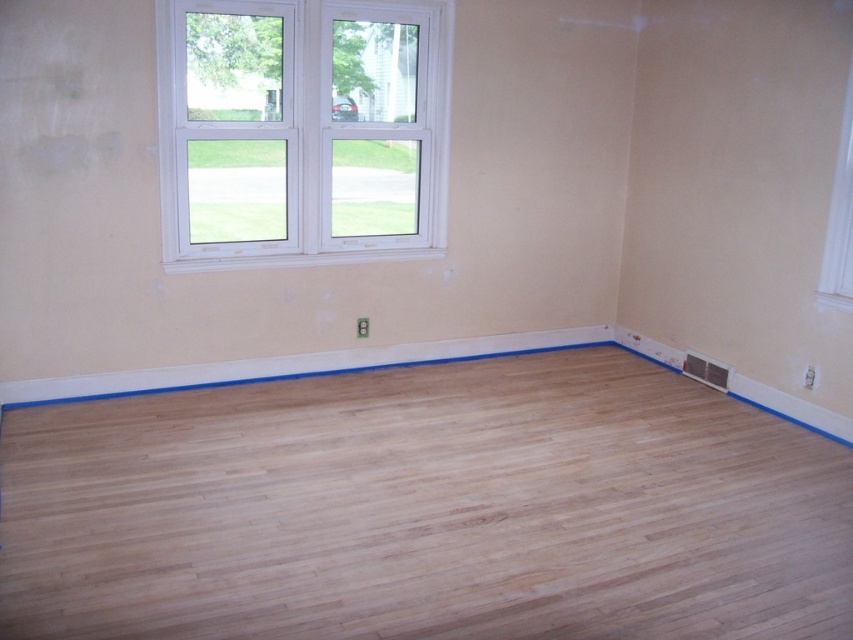
Question: Which of the following is the farthest from the observer?

Choices:
 (A) (80, 408)
 (B) (160, 8)

Answer: (A)

Question: Does natural wood floor at center have a lesser width compared to white plastic window at upper left?

Choices:
 (A) no
 (B) yes

Answer: (A)

Question: Considering the relative positions of natural wood floor at center and white plastic window at upper left in the image provided, where is natural wood floor at center located with respect to white plastic window at upper left?

Choices:
 (A) right
 (B) left

Answer: (A)

Question: Can you confirm if natural wood floor at center is thinner than white plastic window at upper left?

Choices:
 (A) no
 (B) yes

Answer: (A)

Question: Which point is farther to the camera?

Choices:
 (A) natural wood floor at center
 (B) white plastic window at upper left

Answer: (B)

Question: Which object is farther from the camera taking this photo?

Choices:
 (A) white plastic window at upper left
 (B) natural wood floor at center

Answer: (A)